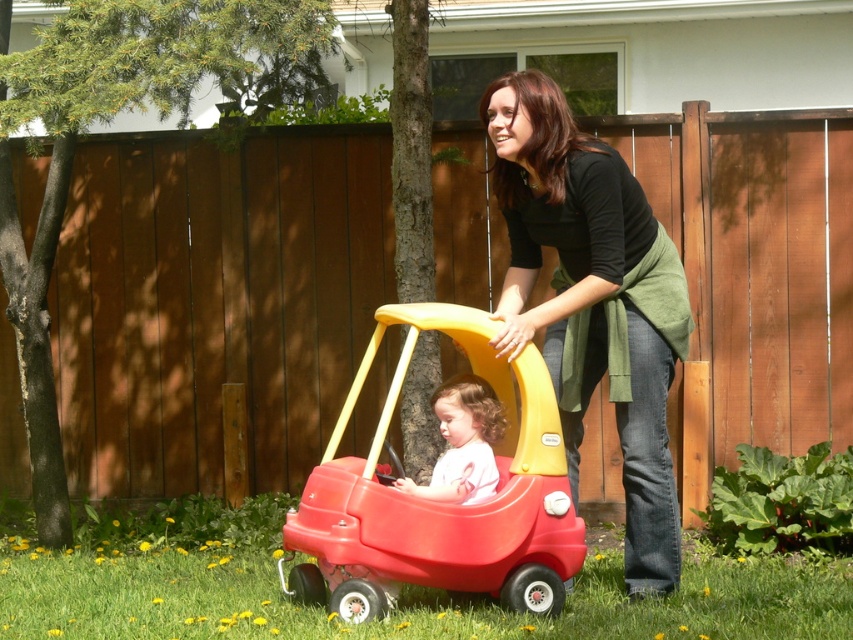
Can you confirm if black matte shirt at center is wider than matte pink shirt at center?

Yes, black matte shirt at center is wider than matte pink shirt at center.

Which is above, black matte shirt at center or matte pink shirt at center?

black matte shirt at center

I want to click on black matte shirt at center, so click(x=593, y=300).

Between point (664, 536) and point (386, 518), which one is positioned behind?

Point (664, 536)

You are a GUI agent. You are given a task and a screenshot of the screen. Output one action in this format:
    pyautogui.click(x=<x>, y=<y>)
    Task: Click on the black matte shirt at center
    The width and height of the screenshot is (853, 640).
    Given the screenshot: What is the action you would take?
    pyautogui.click(x=593, y=300)

You are a GUI agent. You are given a task and a screenshot of the screen. Output one action in this format:
    pyautogui.click(x=<x>, y=<y>)
    Task: Click on the black matte shirt at center
    This screenshot has height=640, width=853.
    Given the screenshot: What is the action you would take?
    pyautogui.click(x=593, y=300)

Is red plastic toy car at center bigger than matte pink shirt at center?

Correct, red plastic toy car at center is larger in size than matte pink shirt at center.

Can you confirm if red plastic toy car at center is positioned below matte pink shirt at center?

Correct, red plastic toy car at center is located below matte pink shirt at center.

Find the location of a particular element. The width and height of the screenshot is (853, 640). red plastic toy car at center is located at coordinates (442, 502).